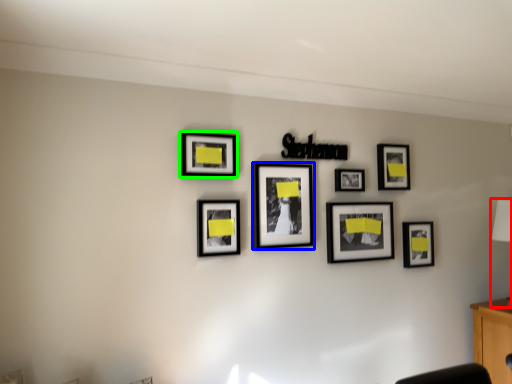
Question: Based on their relative distances, which object is farther from table lamp (highlighted by a red box)? Choose from picture frame (highlighted by a blue box) and picture frame (highlighted by a green box).

Choices:
 (A) picture frame
 (B) picture frame

Answer: (B)